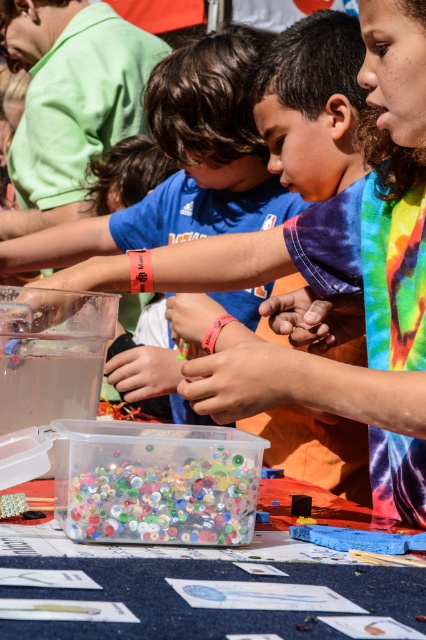
You are a teacher observing the children at the outdoor event. You notice the translucent plastic container at center and the brown leather hand at center. How far apart are these two items from each other?

The translucent plastic container at center and the brown leather hand at center are 62.05 centimeters apart from each other.

You are a participant in the event and need to pick up an item from the table. The table has a translucent plastic hand at lower left and a matte plastic hand at center. If you are standing at the edge of the table, which hand is farther away from you?

The translucent plastic hand at lower left is farther away from you, as it is 38.25 inches away from the matte plastic hand at center, which is closer to the edge of the table where you are standing.